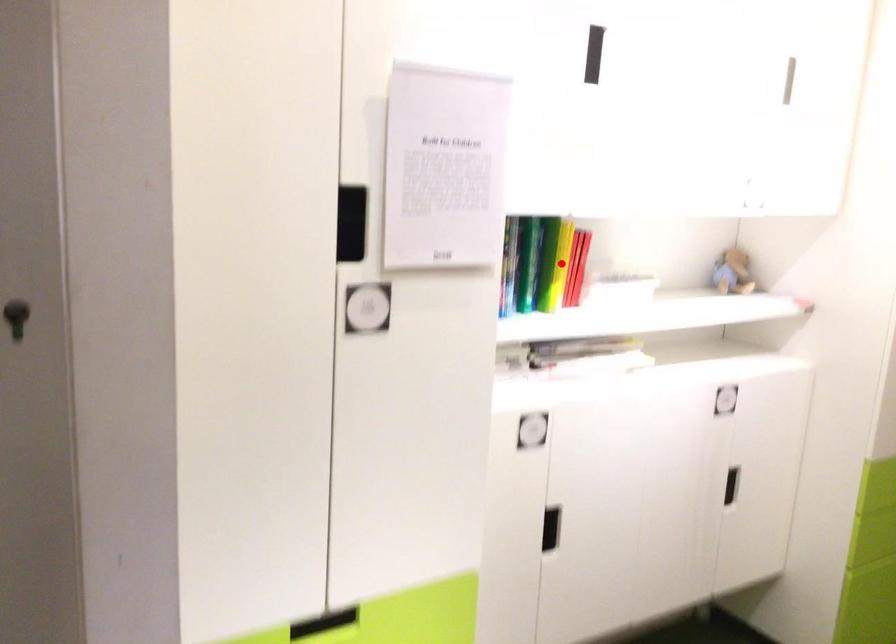
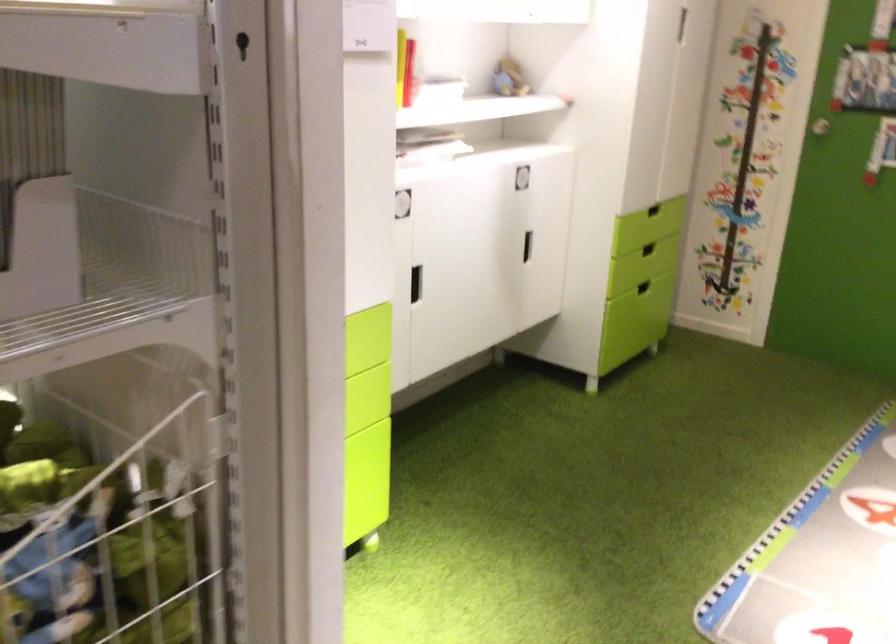
Question: I am providing you with two images of the same scene from different viewpoints. A red point is marked on the first image. Is the red point's position out of view in image 2?

Choices:
 (A) Yes
 (B) No

Answer: (A)